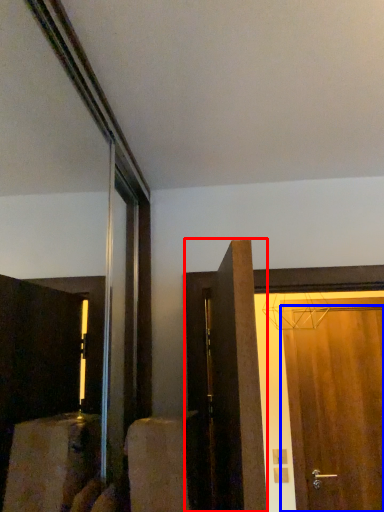
Question: Which point is further to the camera, door (highlighted by a red box) or door (highlighted by a blue box)?

Choices:
 (A) door
 (B) door

Answer: (B)